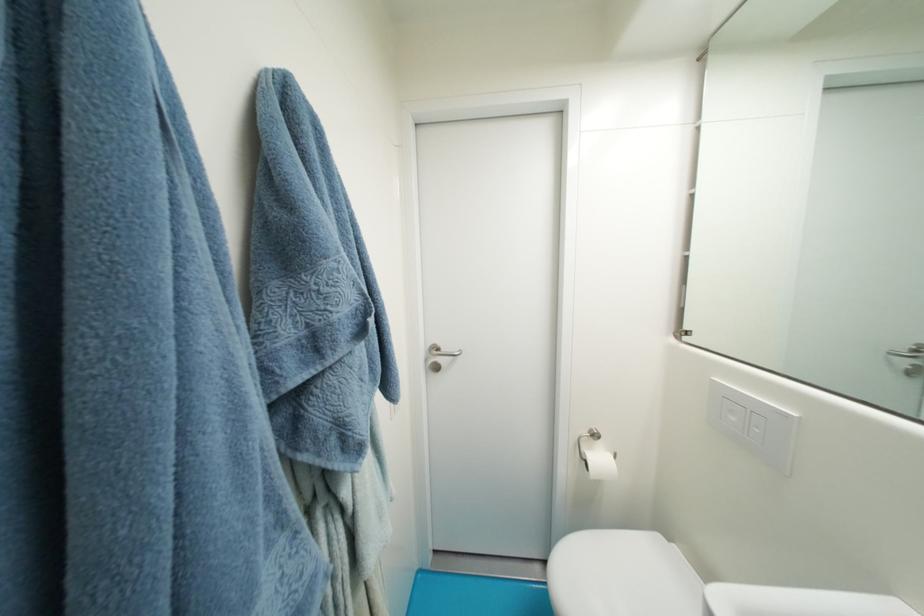
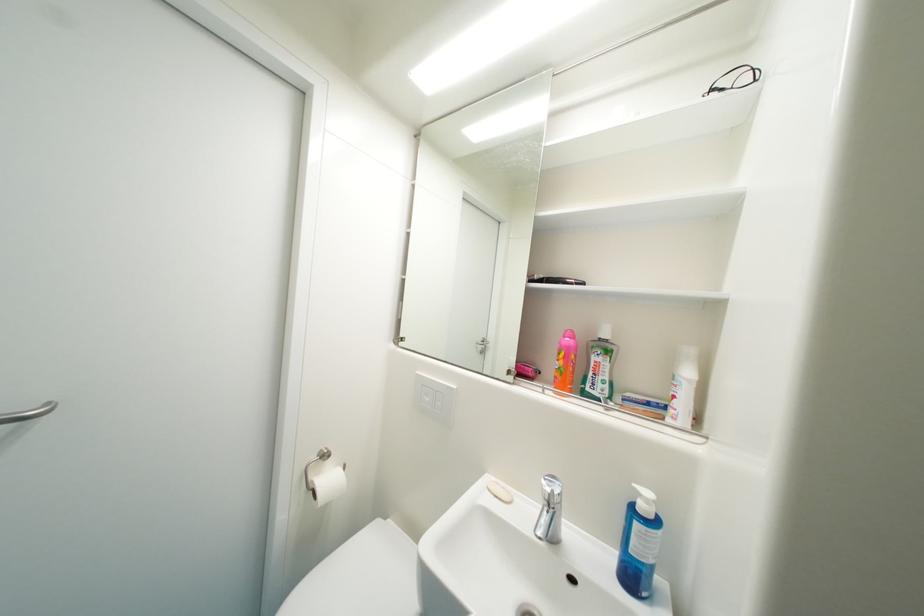
Where in the second image is the point corresponding to pixel 738 421 from the first image?

(433, 400)